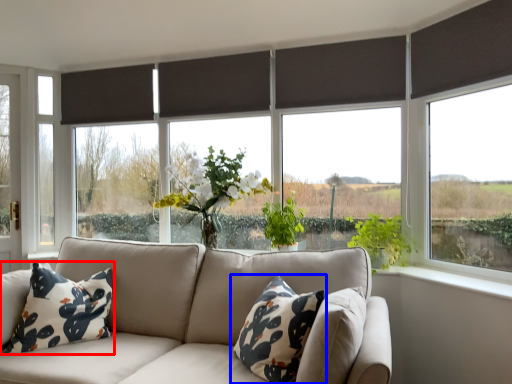
Question: Which object is further to the camera taking this photo, pillow (highlighted by a red box) or pillow (highlighted by a blue box)?

Choices:
 (A) pillow
 (B) pillow

Answer: (A)